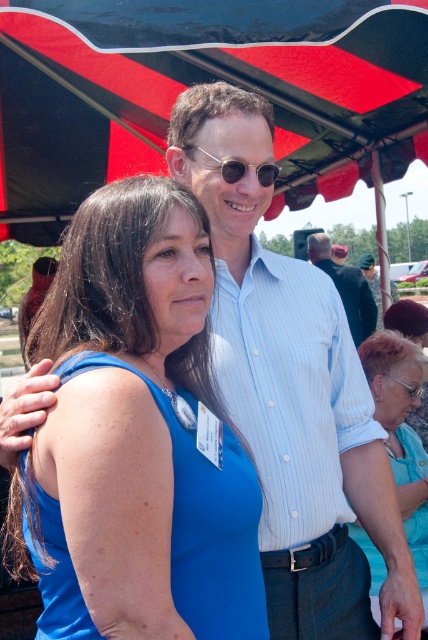
You are organizing a photo shoot and need to arrange the blue fabric dress at center and the dark blue uniform at center side by side. Based on the scene description, which one should you place on the left to ensure they fit within the frame without overlapping?

The blue fabric dress at center is wider than the dark blue uniform at center, so placing the blue fabric dress at center on the left would allow enough space between them to avoid overlapping.

Looking at this image, you are organizing a clothing donation drive and need to determine which item takes up less space when folded. Based on the image, which item is thinner between the blue fabric dress at center and the dark blue shirt at center?

The blue fabric dress at center is thinner than the dark blue shirt at center, so it takes up less space when folded.